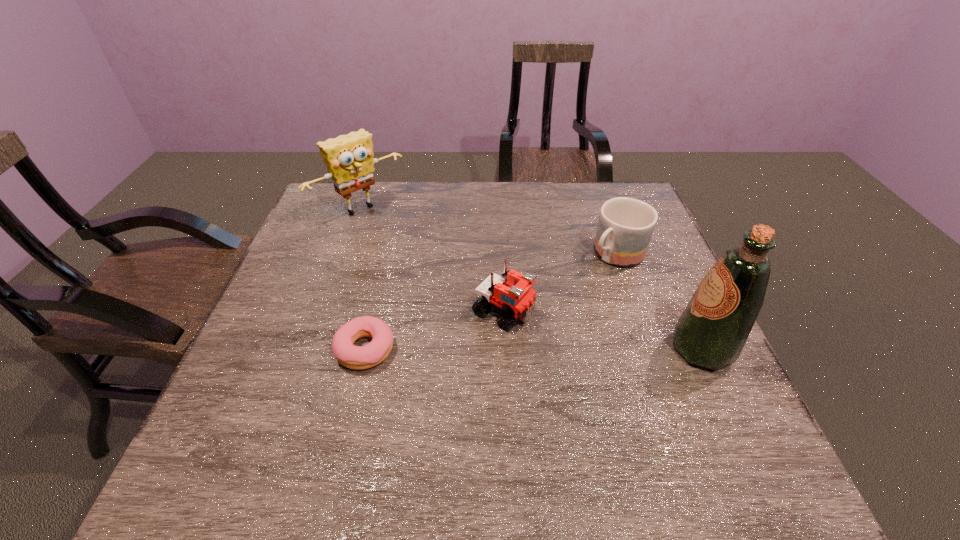
Locate an element on the screen. This screenshot has width=960, height=540. object located at the left edge is located at coordinates (349, 159).

Locate an element on the screen. The image size is (960, 540). olive oil at the right edge is located at coordinates (711, 332).

What are the coordinates of `mug at the right edge` in the screenshot? It's located at (625, 227).

Identify the location of object present at the far left corner. (349, 159).

The image size is (960, 540). In the image, there is a desktop. Identify the location of vacant space at the far edge. (476, 199).

Where is `free space at the near edge of the desktop`? free space at the near edge of the desktop is located at coordinates (655, 429).

This screenshot has height=540, width=960. In order to click on vacant space at the left edge of the desktop in this screenshot , I will do `click(299, 338)`.

This screenshot has height=540, width=960. Find the location of `free region at the right edge of the desktop`. free region at the right edge of the desktop is located at coordinates (647, 302).

Where is `vacant area at the far left corner of the desktop`? vacant area at the far left corner of the desktop is located at coordinates (319, 201).

Where is `blank area at the near left corner`? The height and width of the screenshot is (540, 960). blank area at the near left corner is located at coordinates (242, 422).